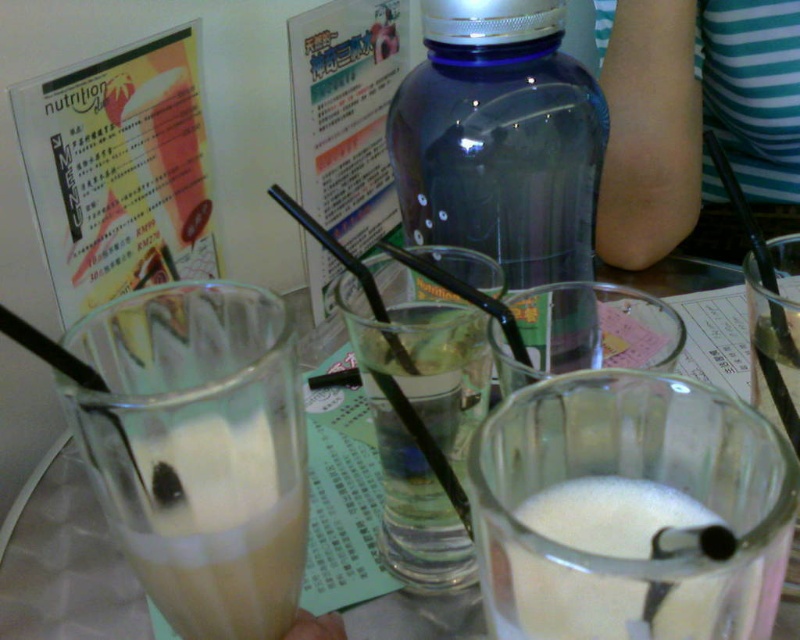
Question: Does white frothy liquid at center have a larger size compared to white frothy milk at lower center?

Choices:
 (A) no
 (B) yes

Answer: (B)

Question: Is transparent plastic bottle at center smaller than white frothy milk at lower center?

Choices:
 (A) no
 (B) yes

Answer: (A)

Question: Which of the following is the closest to the observer?

Choices:
 (A) milky white glass at left
 (B) clear glass cups at center
 (C) white frothy milk at lower center

Answer: (C)

Question: Does white frothy liquid at center appear on the left side of clear glass cups at center?

Choices:
 (A) no
 (B) yes

Answer: (A)

Question: Which object is closer to the camera taking this photo?

Choices:
 (A) clear glass cups at center
 (B) white frothy milk at lower center
 (C) white frothy liquid at center

Answer: (C)

Question: Estimate the real-world distances between objects in this image. Which object is farther from the clear glass cups at center?

Choices:
 (A) white frothy liquid at center
 (B) white frothy milk at lower center
 (C) milky white glass at left

Answer: (B)